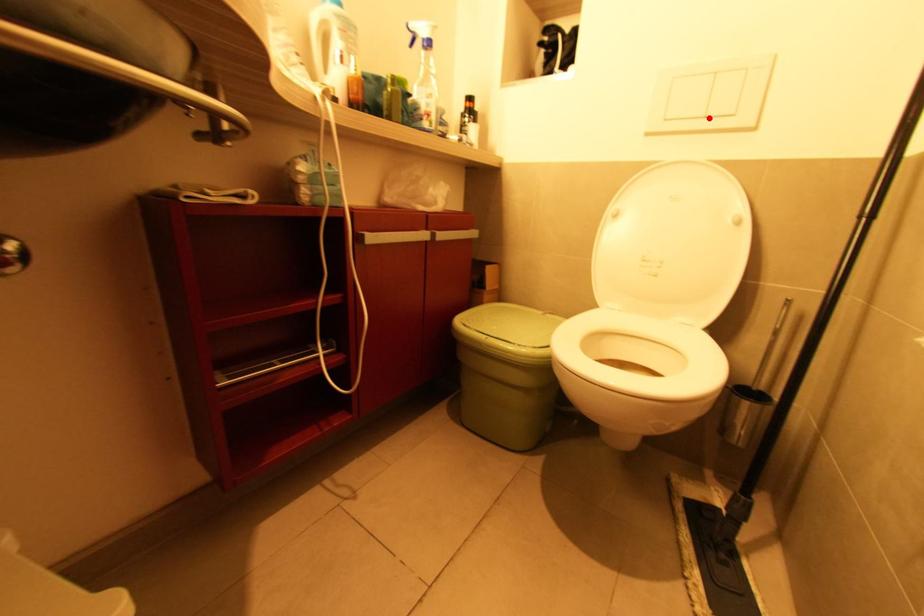
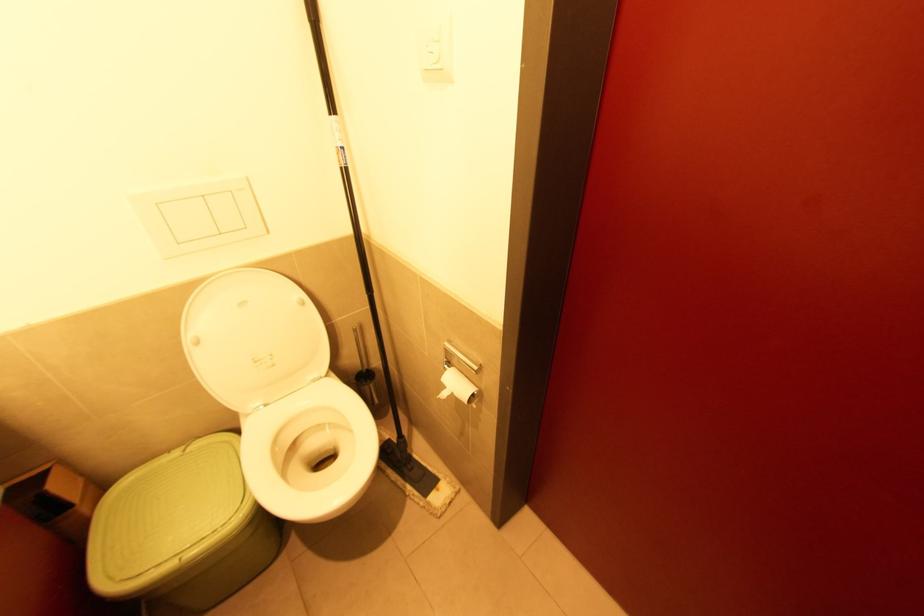
Locate, in the second image, the point that corresponds to the highlighted location in the first image.

(224, 235)